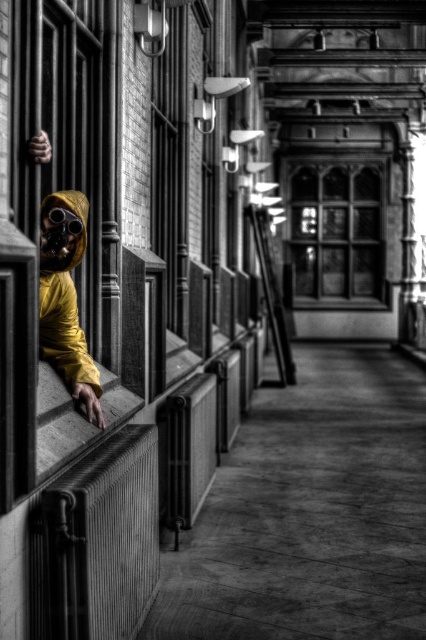
Question: Which object appears closest to the camera in this image?

Choices:
 (A) stained glass window at center
 (B) shiny black goggles at left

Answer: (B)

Question: Can you confirm if stained glass window at center is thinner than shiny black goggles at left?

Choices:
 (A) no
 (B) yes

Answer: (A)

Question: Which point is closer to the camera?

Choices:
 (A) stained glass window at center
 (B) shiny black goggles at left

Answer: (B)

Question: Which of the following is the farthest from the observer?

Choices:
 (A) shiny black goggles at left
 (B) stained glass window at center

Answer: (B)

Question: Does stained glass window at center have a greater width compared to shiny black goggles at left?

Choices:
 (A) no
 (B) yes

Answer: (B)

Question: Does stained glass window at center come behind shiny black goggles at left?

Choices:
 (A) no
 (B) yes

Answer: (B)